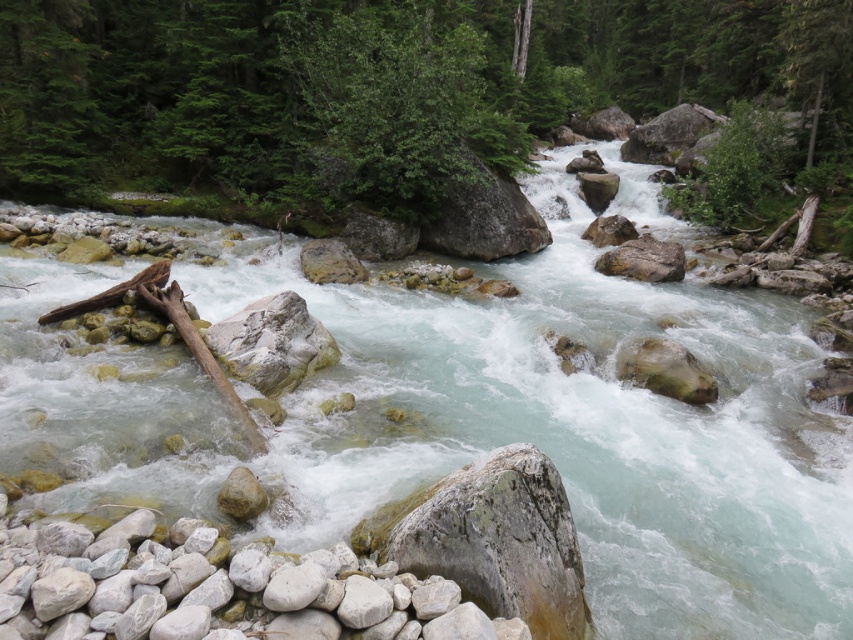
Question: Is green leafy tree at center wider than smooth gray rock at center?

Choices:
 (A) yes
 (B) no

Answer: (A)

Question: Among these points, which one is farthest from the camera?

Choices:
 (A) (234, 508)
 (B) (74, 76)

Answer: (B)

Question: Is green leafy tree at center further to the viewer compared to smooth gray rock at center?

Choices:
 (A) yes
 (B) no

Answer: (A)

Question: Is green leafy tree at center behind smooth gray rock at center?

Choices:
 (A) yes
 (B) no

Answer: (A)